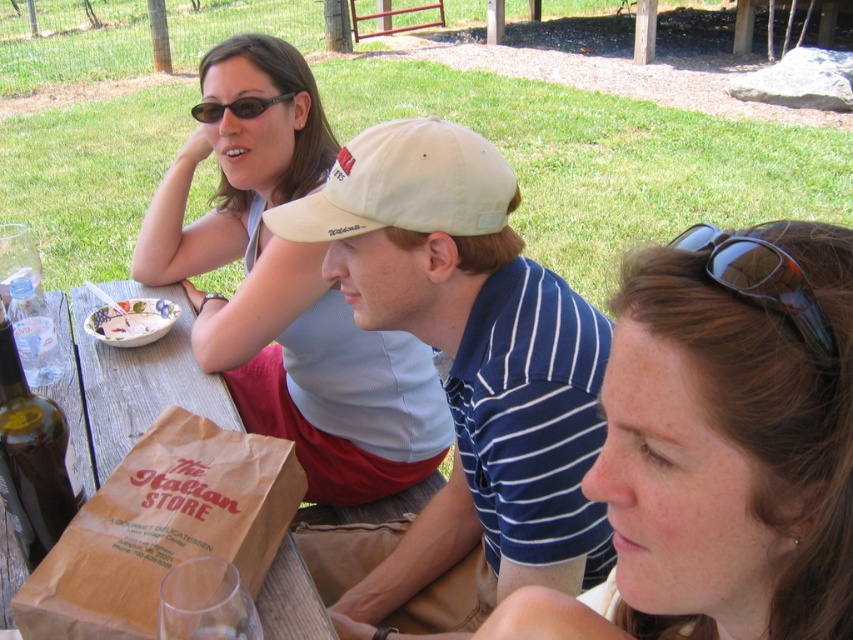
Question: Does matte gray sunglasses at upper left appear under black plastic sunglasses at upper center?

Choices:
 (A) no
 (B) yes

Answer: (B)

Question: Which point is closer to the camera taking this photo?

Choices:
 (A) (161, 602)
 (B) (85, 376)

Answer: (A)

Question: Is white cotton cap at center bigger than white glossy bowl at upper left?

Choices:
 (A) no
 (B) yes

Answer: (B)

Question: Which point appears closest to the camera in this image?

Choices:
 (A) (637, 609)
 (B) (0, 339)

Answer: (A)

Question: Which of these objects is positioned closest to the transparent glass at lower left?

Choices:
 (A) black plastic sunglasses at upper center
 (B) matte gray sunglasses at upper left
 (C) brown paper bag at center
 (D) white fabric baseball cap at center

Answer: (D)

Question: Can you confirm if white cotton cap at center is bigger than white fabric baseball cap at center?

Choices:
 (A) yes
 (B) no

Answer: (A)